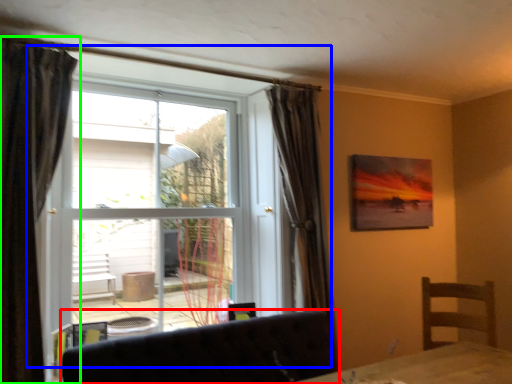
Question: Which object is the farthest from furniture (highlighted by a red box)? Choose among these: window (highlighted by a blue box) or curtain (highlighted by a green box).

Choices:
 (A) window
 (B) curtain

Answer: (A)